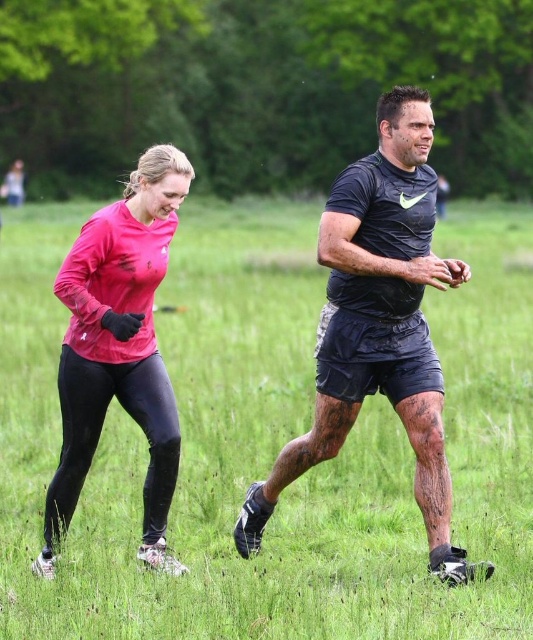
Between point (265, 353) and point (149, 362), which one is positioned in front?

Point (149, 362) is in front.

Does pink fabric leggings at left appear under matte pink long-sleeve shirt at left?

Actually, pink fabric leggings at left is above matte pink long-sleeve shirt at left.

Identify the location of pink fabric leggings at left. The height and width of the screenshot is (640, 533). (270, 442).

At what (x,y) coordinates should I click in order to perform the action: click on pink fabric leggings at left. Please return your answer as a coordinate pair (x, y). This screenshot has height=640, width=533. Looking at the image, I should click on (270, 442).

Does point (296, 442) lie behind point (75, 284)?

Yes, point (296, 442) is farther from viewer.

Based on the photo, who is more distant from viewer, [251,497] or [133,387]?

Point [251,497]

At what (x,y) coordinates should I click in order to perform the action: click on black matte shirt at center. Please return your answer as a coordinate pair (x, y). The image size is (533, 640). Looking at the image, I should click on (378, 324).

Can you confirm if pink fabric leggings at left is positioned above black matte shirt at center?

Yes.

Can you confirm if pink fabric leggings at left is positioned below black matte shirt at center?

Actually, pink fabric leggings at left is above black matte shirt at center.

Between point (488, 310) and point (411, 278), which one is positioned behind?

The point (488, 310) is more distant.

The width and height of the screenshot is (533, 640). Find the location of `pink fabric leggings at left`. pink fabric leggings at left is located at coordinates (270, 442).